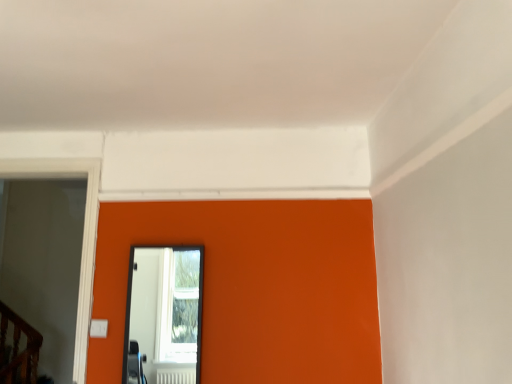
Question: Does point (96, 173) appear closer or farther from the camera than point (192, 344)?

Choices:
 (A) farther
 (B) closer

Answer: (B)

Question: Based on their positions, is transparent glass door at left located to the left or right of black glass mirror at center?

Choices:
 (A) left
 (B) right

Answer: (A)

Question: Choose the correct answer: Is transparent glass door at left inside black glass mirror at center or outside it?

Choices:
 (A) inside
 (B) outside

Answer: (B)

Question: Would you say black glass mirror at center is inside or outside transparent glass door at left?

Choices:
 (A) outside
 (B) inside

Answer: (A)

Question: Based on their sizes in the image, would you say black glass mirror at center is bigger or smaller than transparent glass door at left?

Choices:
 (A) big
 (B) small

Answer: (B)

Question: In terms of width, does black glass mirror at center look wider or thinner when compared to transparent glass door at left?

Choices:
 (A) wide
 (B) thin

Answer: (B)

Question: Would you say black glass mirror at center is to the left or to the right of transparent glass door at left in the picture?

Choices:
 (A) left
 (B) right

Answer: (B)